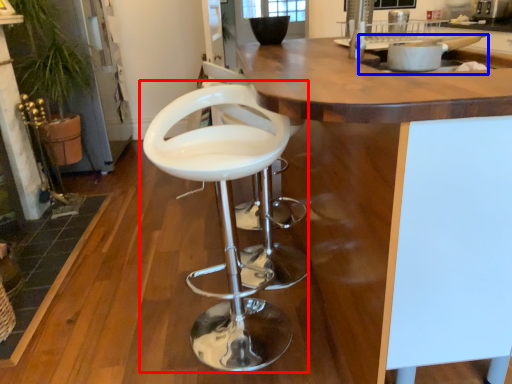
Question: Which object appears closest to the camera in this image, chair (highlighted by a red box) or sink (highlighted by a blue box)?

Choices:
 (A) chair
 (B) sink

Answer: (A)